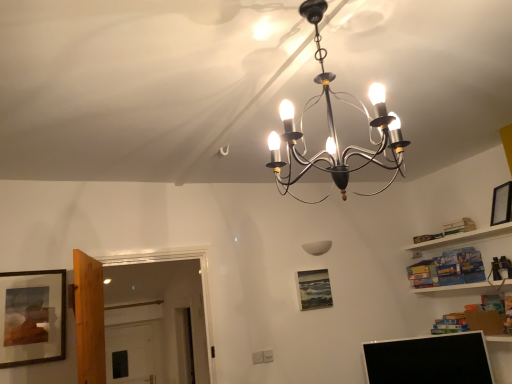
Find the location of a particular element. black glossy computer monitor at lower right is located at coordinates (429, 360).

Locate an element on the screen. This screenshot has width=512, height=384. wooden-framed painting at left, the 3th picture frame from the right is located at coordinates (32, 317).

Measure the distance between point (x=303, y=297) and camera.

11.48 feet.

Where is `black glossy computer monitor at lower right`? The image size is (512, 384). black glossy computer monitor at lower right is located at coordinates (429, 360).

Considering the sizes of objects black matte picture frame at upper right, placed as the 3th picture frame when sorted from bottom to top, and white matte wall lamp at center, which ranks as the 2th lamp in top-to-bottom order, in the image provided, who is wider, black matte picture frame at upper right, placed as the 3th picture frame when sorted from bottom to top, or white matte wall lamp at center, which ranks as the 2th lamp in top-to-bottom order,?

Wider between the two is black matte picture frame at upper right, placed as the 3th picture frame when sorted from bottom to top.

Which is in front, black matte picture frame at upper right, the 2th picture frame in the front-to-back sequence, or white matte wall lamp at center, marked as the 1th lamp in a back-to-front arrangement?

black matte picture frame at upper right, the 2th picture frame in the front-to-back sequence, is more forward.

From the image's perspective, is black matte picture frame at upper right, placed as the 3th picture frame when sorted from bottom to top, above or below white matte wall lamp at center, acting as the 2th lamp starting from the front?

Based on their image positions, black matte picture frame at upper right, placed as the 3th picture frame when sorted from bottom to top, is located above white matte wall lamp at center, acting as the 2th lamp starting from the front.

Is matte black picture frame at center, the 3th picture frame in the front-to-back sequence, bigger than metallic chandelier at center, acting as the 1th lamp starting from the top?

No.

Could you tell me if matte black picture frame at center, the 2th picture frame viewed from the right, is turned towards metallic chandelier at center, acting as the 1th lamp starting from the top?

No, matte black picture frame at center, the 2th picture frame viewed from the right, is not turned towards metallic chandelier at center, acting as the 1th lamp starting from the top.

Considering the relative positions of matte black picture frame at center, the first picture frame when ordered from bottom to top, and metallic chandelier at center, the 2th lamp from the bottom, in the image provided, is matte black picture frame at center, the first picture frame when ordered from bottom to top, behind metallic chandelier at center, the 2th lamp from the bottom,?

Yes, it is.

Is matte black picture frame at center, the 3th picture frame in the front-to-back sequence, positioned beyond the bounds of metallic chandelier at center, acting as the 1th lamp starting from the top?

That's correct, matte black picture frame at center, the 3th picture frame in the front-to-back sequence, is outside of metallic chandelier at center, acting as the 1th lamp starting from the top.

Are matte black picture frame at center, the 3th picture frame in the front-to-back sequence, and black matte picture frame at upper right, which appears as the first picture frame when viewed from the top, far apart?

That's right, there is a large distance between matte black picture frame at center, the 3th picture frame in the front-to-back sequence, and black matte picture frame at upper right, which appears as the first picture frame when viewed from the top.

From the image's perspective, is matte black picture frame at center, marked as the third picture frame in a top-to-bottom arrangement, located above or below black matte picture frame at upper right, which is the first picture frame from right to left?

Clearly, from the image's perspective, matte black picture frame at center, marked as the third picture frame in a top-to-bottom arrangement, is below black matte picture frame at upper right, which is the first picture frame from right to left.

Can you confirm if matte black picture frame at center, the first picture frame when ordered from bottom to top, is positioned to the right of black matte picture frame at upper right, the 2th picture frame in the back-to-front sequence?

Incorrect, matte black picture frame at center, the first picture frame when ordered from bottom to top, is not on the right side of black matte picture frame at upper right, the 2th picture frame in the back-to-front sequence.

Is point (319, 301) more distant than point (496, 211)?

Yes, it is behind point (496, 211).

How many degrees apart are the facing directions of white matte wall lamp at center, marked as the 1th lamp in a back-to-front arrangement, and metallic chandelier at center, acting as the 1th lamp starting from the top?

white matte wall lamp at center, marked as the 1th lamp in a back-to-front arrangement, and metallic chandelier at center, acting as the 1th lamp starting from the top, are facing 94.9 degrees away from each other.

Which object is further away from the camera taking this photo, white matte wall lamp at center, which ranks as the 2th lamp in top-to-bottom order, or metallic chandelier at center, acting as the 1th lamp starting from the top?

white matte wall lamp at center, which ranks as the 2th lamp in top-to-bottom order, is further away from the camera.

Could you tell me if white matte wall lamp at center, which ranks as the 2th lamp in top-to-bottom order, is facing metallic chandelier at center, the 2th lamp from the bottom?

No, white matte wall lamp at center, which ranks as the 2th lamp in top-to-bottom order, does not turn towards metallic chandelier at center, the 2th lamp from the bottom.

From a real-world perspective, is white matte wall lamp at center, acting as the 2th lamp starting from the front, on top of metallic chandelier at center, marked as the 1th lamp in a front-to-back arrangement?

No, from a real-world perspective, white matte wall lamp at center, acting as the 2th lamp starting from the front, is not above metallic chandelier at center, marked as the 1th lamp in a front-to-back arrangement.

Is black glossy computer monitor at lower right wider than wooden-framed painting at left, the 2th picture frame viewed from the top?

Correct, the width of black glossy computer monitor at lower right exceeds that of wooden-framed painting at left, the 2th picture frame viewed from the top.

Is black glossy computer monitor at lower right oriented away from wooden-framed painting at left, the 3th picture frame from the right?

black glossy computer monitor at lower right is not turned away from wooden-framed painting at left, the 3th picture frame from the right.

From the image's perspective, which one is positioned lower, black glossy computer monitor at lower right or wooden-framed painting at left, the 2th picture frame viewed from the top?

From the image's view, black glossy computer monitor at lower right is below.

Based on the photo, is black glossy computer monitor at lower right at the left side of black matte picture frame at upper right, which appears as the first picture frame when viewed from the top?

Yes, black glossy computer monitor at lower right is to the left of black matte picture frame at upper right, which appears as the first picture frame when viewed from the top.

Can you tell me how much black glossy computer monitor at lower right and black matte picture frame at upper right, the 2th picture frame in the front-to-back sequence, differ in facing direction?

They differ by 78.1 degrees in their facing directions.

Is black glossy computer monitor at lower right smaller than black matte picture frame at upper right, which appears as the first picture frame when viewed from the top?

Actually, black glossy computer monitor at lower right might be larger than black matte picture frame at upper right, which appears as the first picture frame when viewed from the top.

From a real-world perspective, is black glossy computer monitor at lower right physically located above or below black matte picture frame at upper right, which is the first picture frame from right to left?

black glossy computer monitor at lower right is below black matte picture frame at upper right, which is the first picture frame from right to left.

Does matte black picture frame at center, the first picture frame from the back, touch wooden-framed painting at left, the 3th picture frame from the right?

matte black picture frame at center, the first picture frame from the back, is not next to wooden-framed painting at left, the 3th picture frame from the right, and they're not touching.

Does matte black picture frame at center, acting as the second picture frame starting from the left, contain wooden-framed painting at left, placed as the 3th picture frame when sorted from back to front?

No, wooden-framed painting at left, placed as the 3th picture frame when sorted from back to front, is located outside of matte black picture frame at center, acting as the second picture frame starting from the left.

Can you confirm if matte black picture frame at center, marked as the third picture frame in a top-to-bottom arrangement, is bigger than wooden-framed painting at left, placed as the 3th picture frame when sorted from back to front?

Incorrect, matte black picture frame at center, marked as the third picture frame in a top-to-bottom arrangement, is not larger than wooden-framed painting at left, placed as the 3th picture frame when sorted from back to front.

In terms of height, does matte black picture frame at center, marked as the third picture frame in a top-to-bottom arrangement, look taller or shorter compared to wooden-framed painting at left, acting as the 1th picture frame starting from the front?

Clearly, matte black picture frame at center, marked as the third picture frame in a top-to-bottom arrangement, is shorter compared to wooden-framed painting at left, acting as the 1th picture frame starting from the front.

The image size is (512, 384). In order to click on lamp behind the black matte picture frame at upper right, the 2th picture frame in the front-to-back sequence in this screenshot , I will do `click(317, 247)`.

Where is `the 3rd picture frame directly beneath the metallic chandelier at center, the second lamp viewed from the back (from a real-world perspective)`? This screenshot has height=384, width=512. the 3rd picture frame directly beneath the metallic chandelier at center, the second lamp viewed from the back (from a real-world perspective) is located at coordinates (314, 289).

From the image, which object appears to be farther from white matte wall lamp at center, which ranks as the 2th lamp in top-to-bottom order, matte black picture frame at center, marked as the third picture frame in a top-to-bottom arrangement, or black glossy computer monitor at lower right?

Based on the image, black glossy computer monitor at lower right appears to be further to white matte wall lamp at center, which ranks as the 2th lamp in top-to-bottom order.

Estimate the real-world distances between objects in this image. Which object is further from wooden-framed painting at left, the 3th picture frame from the right, metallic chandelier at center, marked as the 1th lamp in a front-to-back arrangement, or black glossy computer monitor at lower right?

Based on the image, black glossy computer monitor at lower right appears to be further to wooden-framed painting at left, the 3th picture frame from the right.

Considering their positions, is matte black picture frame at center, acting as the second picture frame starting from the left, positioned further to black matte picture frame at upper right, placed as the 3th picture frame when sorted from bottom to top, than wooden-framed painting at left, the 3th picture frame from the right?

wooden-framed painting at left, the 3th picture frame from the right, is positioned further to the anchor black matte picture frame at upper right, placed as the 3th picture frame when sorted from bottom to top.

When comparing their distances from black glossy computer monitor at lower right, does black matte picture frame at upper right, which is the first picture frame from right to left, or wooden-framed painting at left, placed as the 3th picture frame when sorted from back to front, seem closer?

black matte picture frame at upper right, which is the first picture frame from right to left, is positioned closer to the anchor black glossy computer monitor at lower right.

From the image, which object appears to be nearer to black matte picture frame at upper right, which appears as the first picture frame when viewed from the top, white matte wall lamp at center, the first lamp ordered from the bottom, or black glossy computer monitor at lower right?

The object closer to black matte picture frame at upper right, which appears as the first picture frame when viewed from the top, is black glossy computer monitor at lower right.

Based on their spatial positions, is white matte wall lamp at center, marked as the 1th lamp in a back-to-front arrangement, or metallic chandelier at center, acting as the 1th lamp starting from the top, closer to matte black picture frame at center, the first picture frame when ordered from bottom to top?

Based on the image, white matte wall lamp at center, marked as the 1th lamp in a back-to-front arrangement, appears to be nearer to matte black picture frame at center, the first picture frame when ordered from bottom to top.

Which object lies further to the anchor point black glossy computer monitor at lower right, metallic chandelier at center, the second lamp viewed from the back, or matte black picture frame at center, acting as the second picture frame starting from the left?

metallic chandelier at center, the second lamp viewed from the back.

Looking at this image, from the image, which object appears to be farther from matte black picture frame at center, marked as the third picture frame in a top-to-bottom arrangement, wooden-framed painting at left, placed as the 3th picture frame when sorted from back to front, or black glossy computer monitor at lower right?

wooden-framed painting at left, placed as the 3th picture frame when sorted from back to front, is positioned further to the anchor matte black picture frame at center, marked as the third picture frame in a top-to-bottom arrangement.

Locate an element on the screen. The image size is (512, 384). computer monitor between metallic chandelier at center, the second lamp viewed from the back, and matte black picture frame at center, the first picture frame when ordered from bottom to top, along the z-axis is located at coordinates (429, 360).

The height and width of the screenshot is (384, 512). Find the location of `computer monitor between white matte wall lamp at center, acting as the 2th lamp starting from the front, and black matte picture frame at upper right, the 2th picture frame in the front-to-back sequence, from left to right`. computer monitor between white matte wall lamp at center, acting as the 2th lamp starting from the front, and black matte picture frame at upper right, the 2th picture frame in the front-to-back sequence, from left to right is located at coordinates [429, 360].

Image resolution: width=512 pixels, height=384 pixels. What are the coordinates of `picture frame situated between wooden-framed painting at left, the 3th picture frame from the right, and white matte wall lamp at center, the first lamp ordered from the bottom, from left to right` in the screenshot? It's located at (314, 289).

The image size is (512, 384). What are the coordinates of `picture frame situated between wooden-framed painting at left, which is the 1th picture frame in left-to-right order, and black glossy computer monitor at lower right from left to right` in the screenshot? It's located at (314, 289).